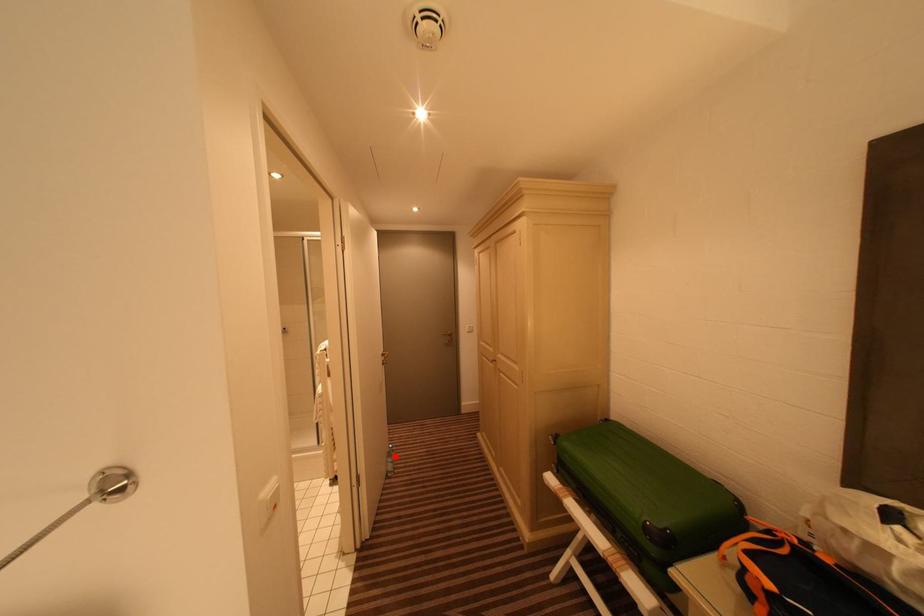
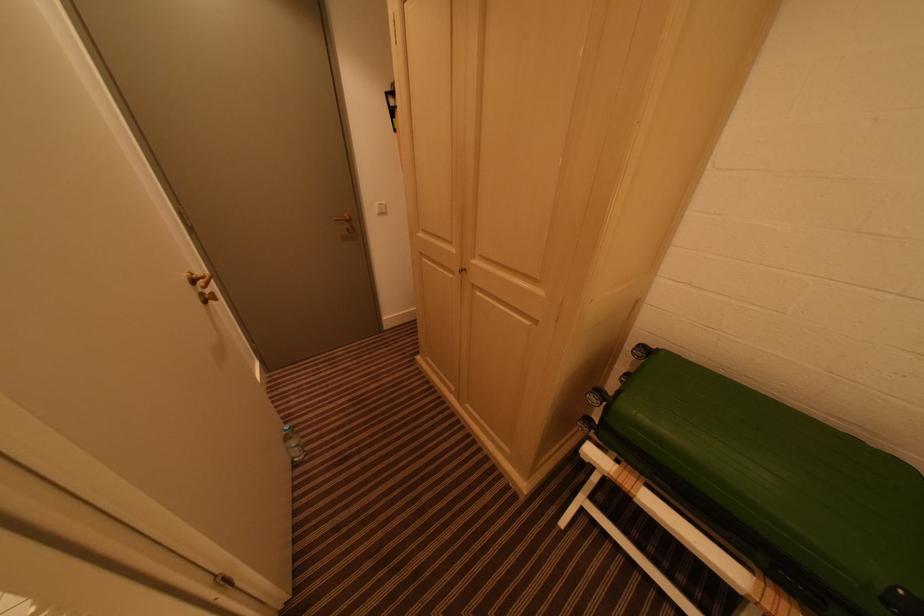
The point at the highlighted location is marked in the first image. Where is the corresponding point in the second image?

(293, 440)